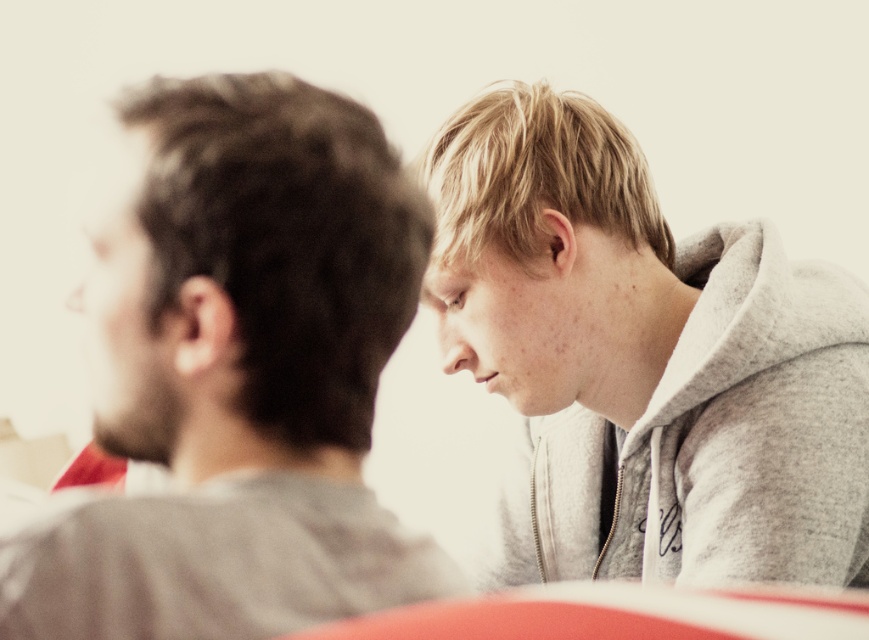
You are a photographer trying to adjust the lighting for a portrait. You notice the gray matte shirt at left and the gray fleece hoodie at upper right in the frame. Which object appears shorter in the photo?

The gray matte shirt at left appears shorter than the gray fleece hoodie at upper right because it is not as tall as the latter.

You are taking a photo of two people sitting on a couch. You notice two points in the image labeled as point [209,608] and point [848,356]. Which point is closer to the camera?

Point [209,608] is closer to the camera than point [848,356].